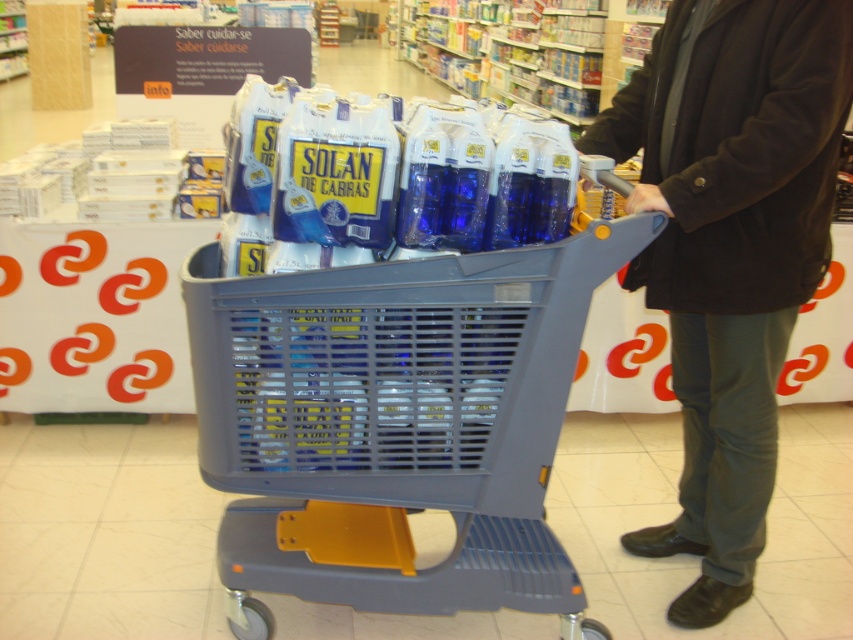
Question: Does gray plastic trolley at center lie behind dark brown wool coat at center?

Choices:
 (A) yes
 (B) no

Answer: (B)

Question: Is gray plastic trolley at center to the left of dark brown wool coat at center from the viewer's perspective?

Choices:
 (A) yes
 (B) no

Answer: (A)

Question: Does gray plastic trolley at center appear over dark brown wool coat at center?

Choices:
 (A) no
 (B) yes

Answer: (A)

Question: Which point appears farthest from the camera in this image?

Choices:
 (A) (537, 541)
 (B) (769, 83)

Answer: (A)

Question: Which object appears closest to the camera in this image?

Choices:
 (A) dark brown wool coat at center
 (B) gray plastic trolley at center

Answer: (B)